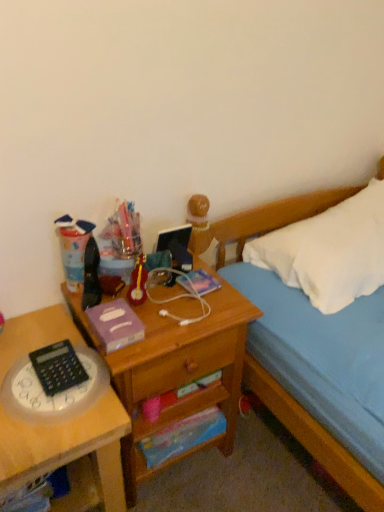
Identify the location of empty space that is ontop of translucent plastic clock at lower left (from a real-world perspective). (46, 382).